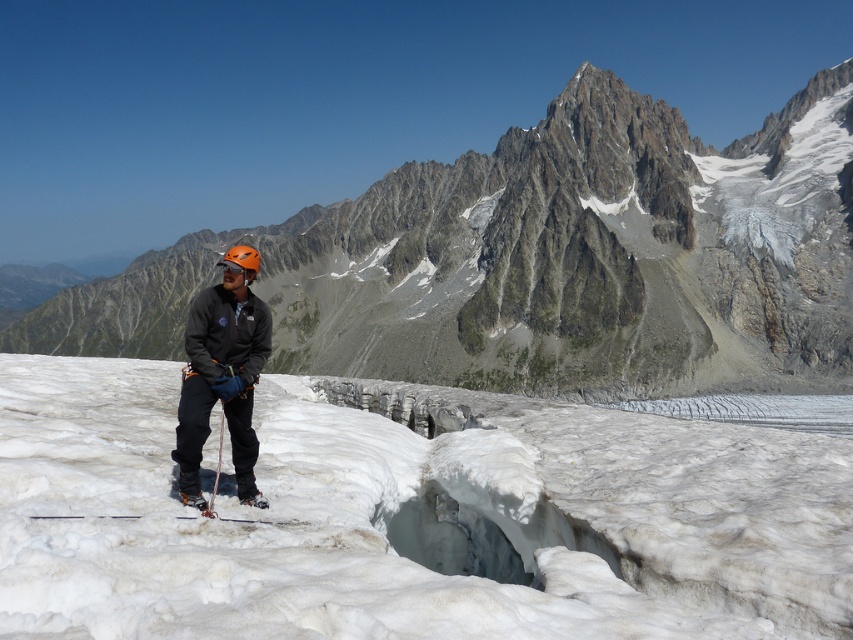
Question: Does rugged granite mountain at center have a lesser width compared to white plastic ski at center?

Choices:
 (A) yes
 (B) no

Answer: (B)

Question: Is the position of white frosty snow at center more distant than that of white plastic ski at center?

Choices:
 (A) no
 (B) yes

Answer: (A)

Question: Among these objects, which one is nearest to the camera?

Choices:
 (A) white frosty snow at center
 (B) matte black jacket at center
 (C) rugged granite mountain at center
 (D) white plastic ski at center

Answer: (A)

Question: Which object is closer to the camera taking this photo?

Choices:
 (A) matte black jacket at center
 (B) white plastic ski at center
 (C) rugged granite mountain at center
 (D) white frosty snow at center

Answer: (D)

Question: Which object is closer to the camera taking this photo?

Choices:
 (A) matte black jacket at center
 (B) rugged granite mountain at center
 (C) white frosty snow at center
 (D) white plastic ski at center

Answer: (C)

Question: Does matte black jacket at center have a larger size compared to white plastic ski at center?

Choices:
 (A) no
 (B) yes

Answer: (B)